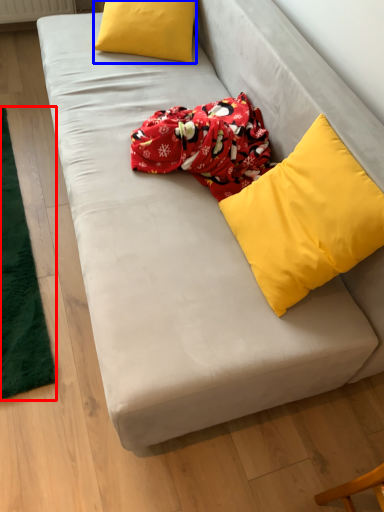
Question: Among these objects, which one is nearest to the camera, mat (highlighted by a red box) or pillow (highlighted by a blue box)?

Choices:
 (A) mat
 (B) pillow

Answer: (A)